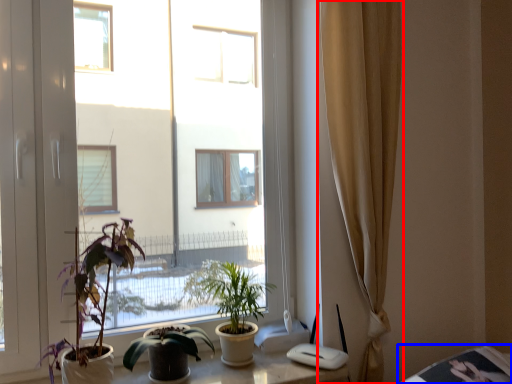
Question: Which point is closer to the camera, curtain (highlighted by a red box) or table (highlighted by a blue box)?

Choices:
 (A) curtain
 (B) table

Answer: (B)